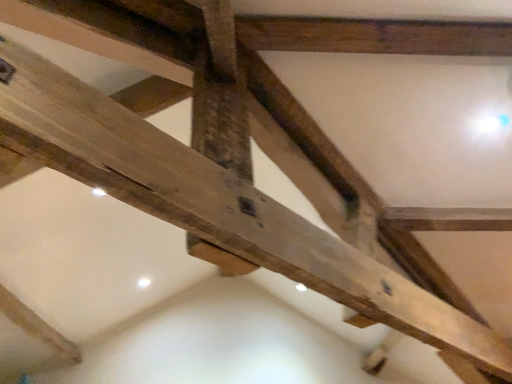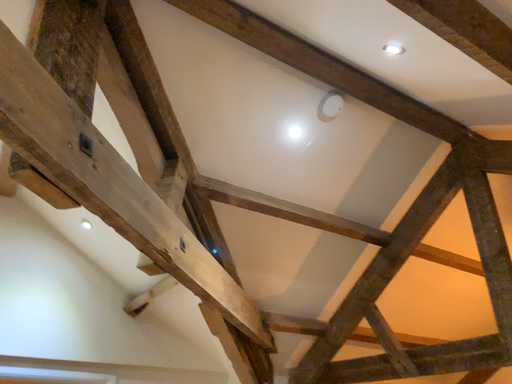
Question: How did the camera likely rotate when shooting the video?

Choices:
 (A) rotated downward
 (B) rotated upward

Answer: (A)